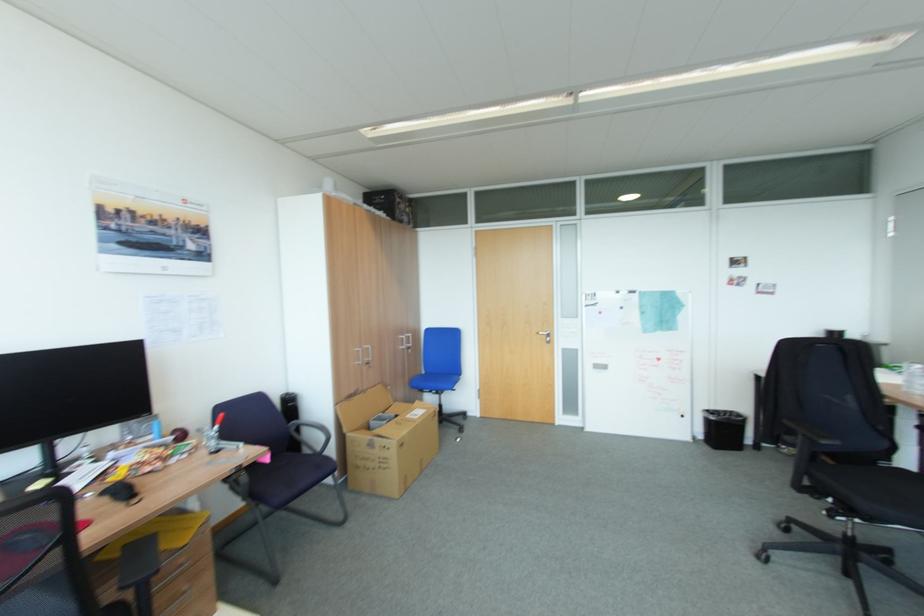
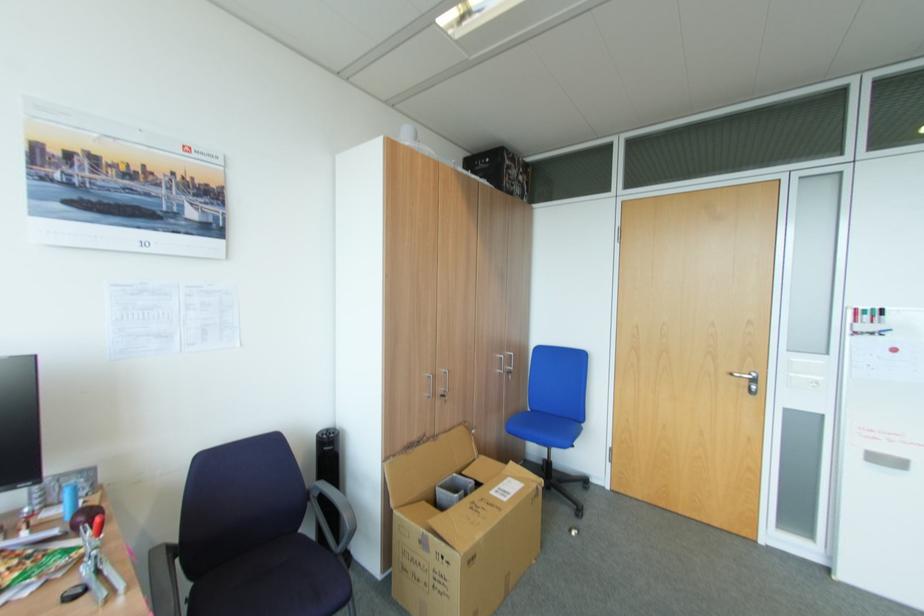
Question: I am providing you with two images of the same scene from different viewpoints. Which of the following objects are not visible in image2?

Choices:
 (A) open cardboard box
 (B) metal cabinet handle
 (C) chair armrest
 (D) none of these

Answer: (D)